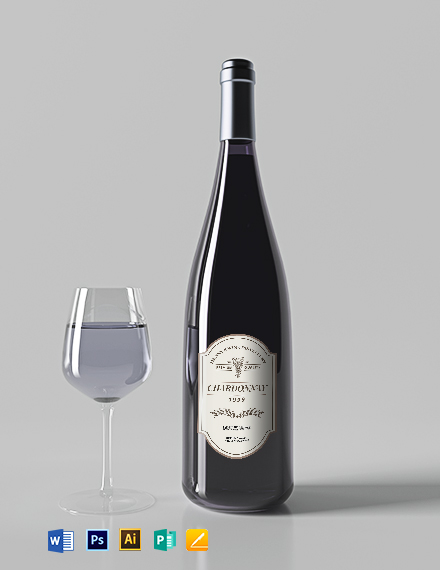
You are a GUI agent. You are given a task and a screenshot of the screen. Output one action in this format:
    pyautogui.click(x=<x>, y=<y>)
    Task: Click on the bottle
    The width and height of the screenshot is (440, 570).
    Given the screenshot: What is the action you would take?
    pyautogui.click(x=270, y=454)